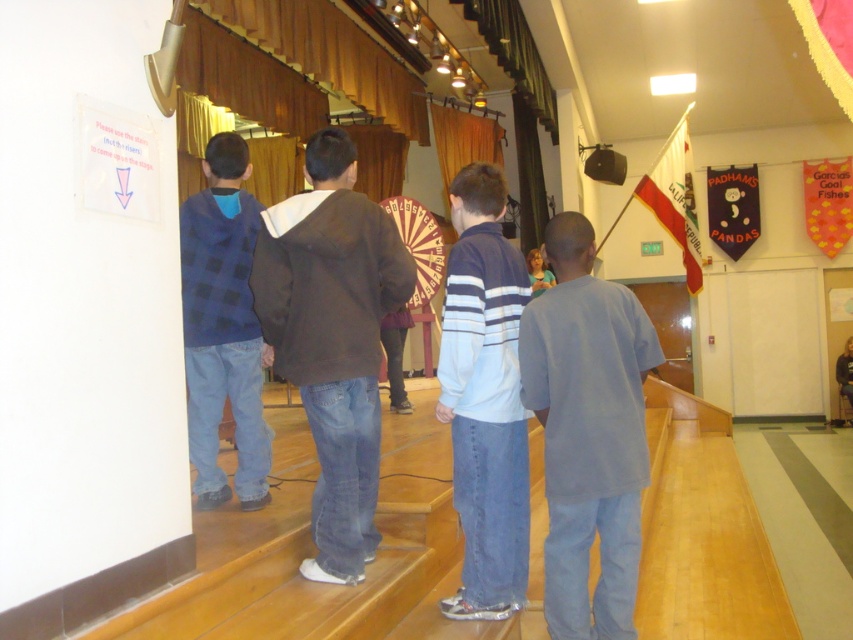
Is point (305, 204) positioned after point (209, 460)?

No.

From the picture: Who is more forward, (331, 435) or (195, 234)?

Point (331, 435)

You are a GUI agent. You are given a task and a screenshot of the screen. Output one action in this format:
    pyautogui.click(x=<x>, y=<y>)
    Task: Click on the dark brown hoodie at center
    This screenshot has width=853, height=640.
    Given the screenshot: What is the action you would take?
    click(x=332, y=339)

Does gray cotton shirt at right appear on the left side of blue striped sweater at center?

In fact, gray cotton shirt at right is to the right of blue striped sweater at center.

Does gray cotton shirt at right appear under blue striped sweater at center?

Yes.

Describe the element at coordinates (589, 432) in the screenshot. I see `gray cotton shirt at right` at that location.

Where is `gray cotton shirt at right`? gray cotton shirt at right is located at coordinates (x=589, y=432).

Is blue striped sweater at center shorter than blue plaid shirt at left?

In fact, blue striped sweater at center may be taller than blue plaid shirt at left.

Can you confirm if blue striped sweater at center is bigger than blue plaid shirt at left?

Yes, blue striped sweater at center is bigger than blue plaid shirt at left.

Based on the photo, measure the distance between point (456, 467) and camera.

They are 3.08 meters apart.

Image resolution: width=853 pixels, height=640 pixels. Find the location of `blue striped sweater at center`. blue striped sweater at center is located at coordinates (485, 397).